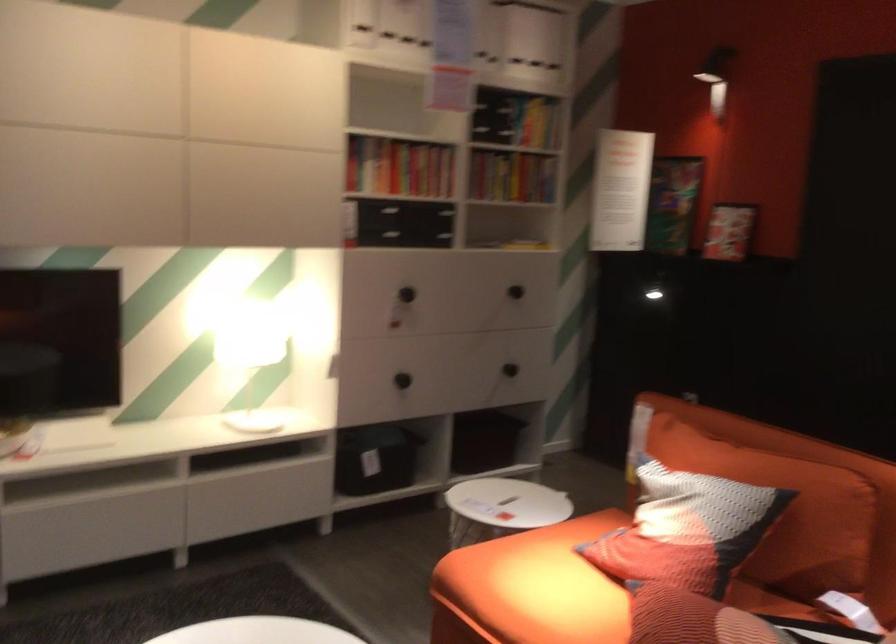
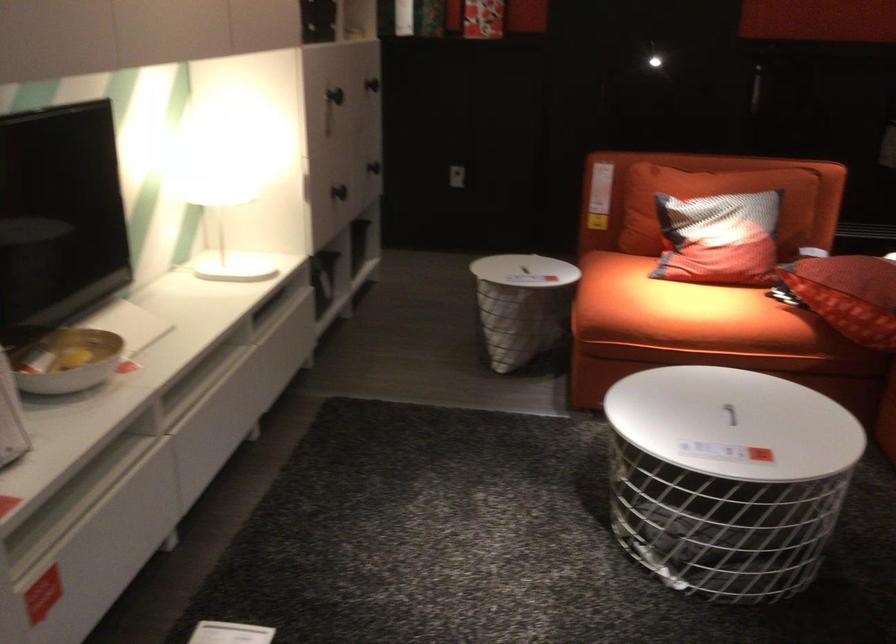
Question: I am providing you with two images of the same scene from different viewpoints. Which of the following objects are not visible in image2?

Choices:
 (A) red patterned pillow
 (B) red and black pillow
 (C) sofa sitting surface
 (D) none of these

Answer: (D)